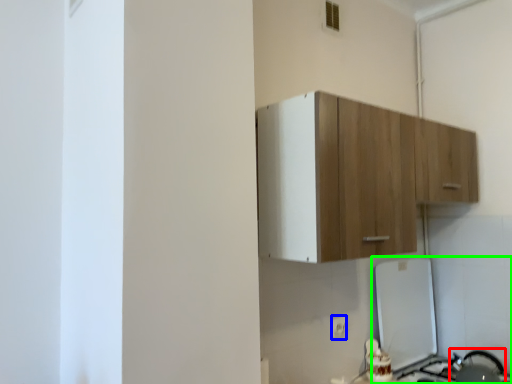
Question: Estimate the real-world distances between objects in this image. Which object is farther from appliance (highlighted by a red box), electric outlet (highlighted by a blue box) or appliance (highlighted by a green box)?

Choices:
 (A) electric outlet
 (B) appliance

Answer: (A)